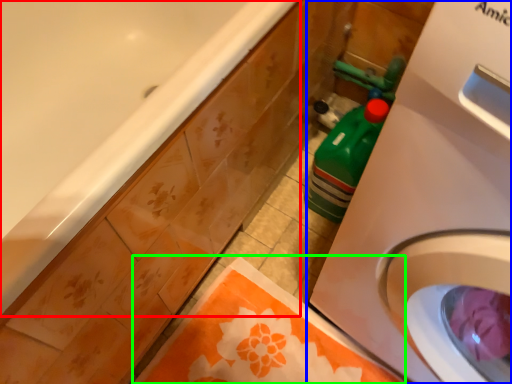
Question: Estimate the real-world distances between objects in this image. Which object is closer to bathtub (highlighted by a red box), washing machine (highlighted by a blue box) or beach towel (highlighted by a green box)?

Choices:
 (A) washing machine
 (B) beach towel

Answer: (A)